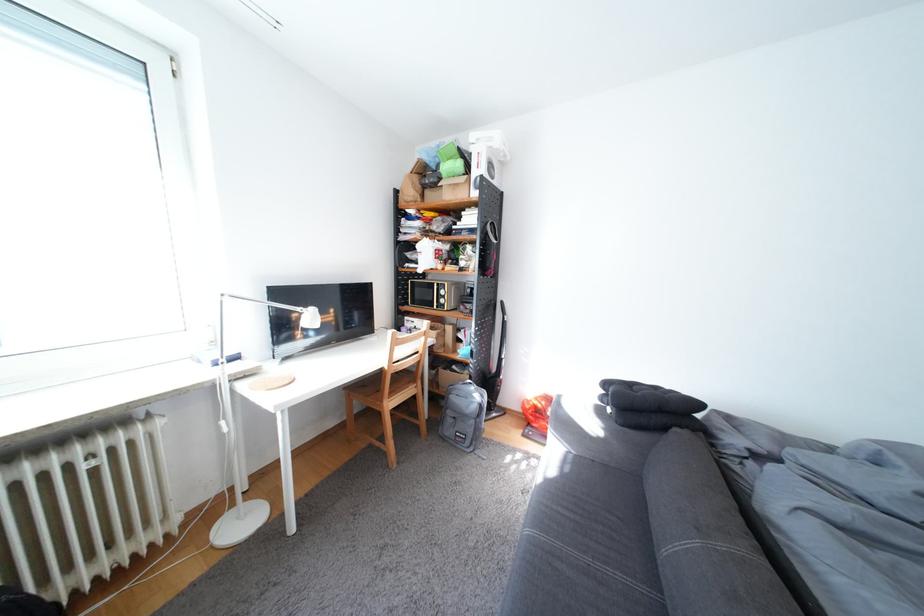
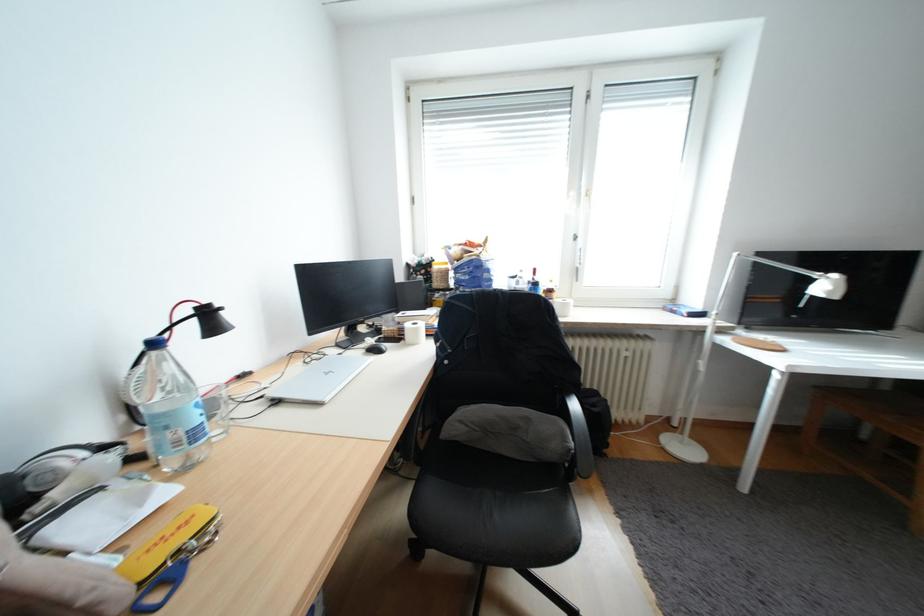
Question: The images are taken continuously from a first-person perspective. In which direction is your viewpoint rotating?

Choices:
 (A) Left
 (B) Right
 (C) Up
 (D) Down

Answer: (A)